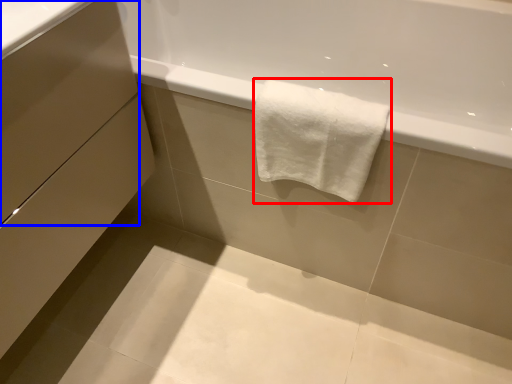
Question: Among these objects, which one is farthest to the camera, towel (highlighted by a red box) or drawer (highlighted by a blue box)?

Choices:
 (A) towel
 (B) drawer

Answer: (A)